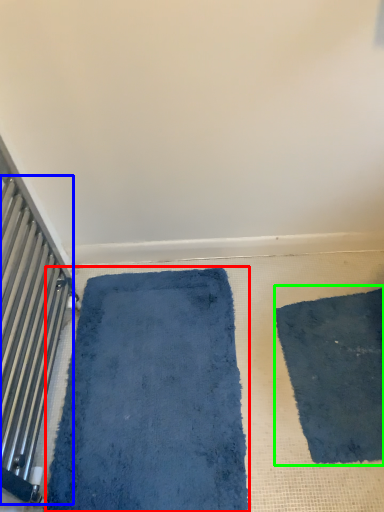
Question: Which object is the closest to the bath mat (highlighted by a red box)? Choose among these: radiator (highlighted by a blue box) or mat (highlighted by a green box).

Choices:
 (A) radiator
 (B) mat

Answer: (A)